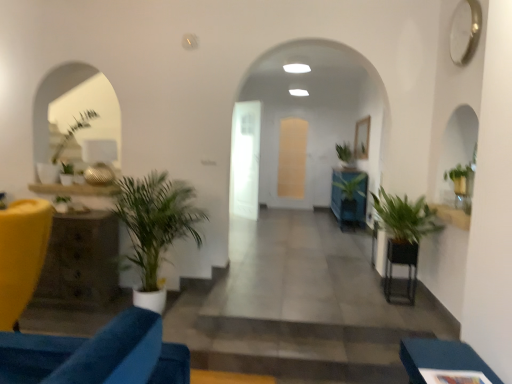
Where is `free space in front of black metal table at lower right, placed as the first table when sorted from right to left`? free space in front of black metal table at lower right, placed as the first table when sorted from right to left is located at coordinates (402, 308).